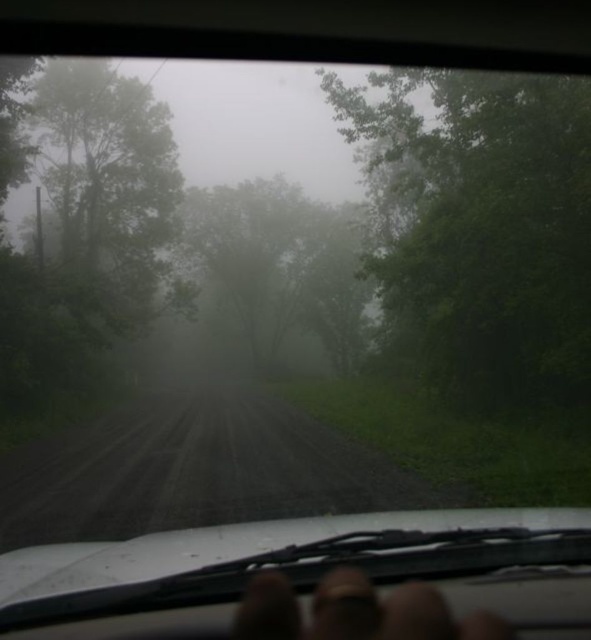
Can you confirm if green leafy tree at right is wider than green leafy tree at left?

In fact, green leafy tree at right might be narrower than green leafy tree at left.

Which is behind, point (556, 250) or point (17, 67)?

Positioned behind is point (17, 67).

What do you see at coordinates (479, 227) in the screenshot? I see `green leafy tree at right` at bounding box center [479, 227].

Find the location of a particular element. This screenshot has width=591, height=640. green leafy tree at right is located at coordinates (479, 227).

Based on the photo, does green leafy tree at right have a smaller size compared to green matte tree at center?

Incorrect, green leafy tree at right is not smaller in size than green matte tree at center.

Who is lower down, green leafy tree at right or green matte tree at center?

Positioned lower is green matte tree at center.

I want to click on green leafy tree at right, so click(x=479, y=227).

Which is above, green leafy tree at left or finger at center?

green leafy tree at left

Does green leafy tree at left come in front of finger at center?

No, it is behind finger at center.

Locate an element on the screen. Image resolution: width=591 pixels, height=640 pixels. green leafy tree at left is located at coordinates (80, 220).

At what (x,y) coordinates should I click in order to perform the action: click on green leafy tree at left. Please return your answer as a coordinate pair (x, y). Image resolution: width=591 pixels, height=640 pixels. Looking at the image, I should click on (80, 220).